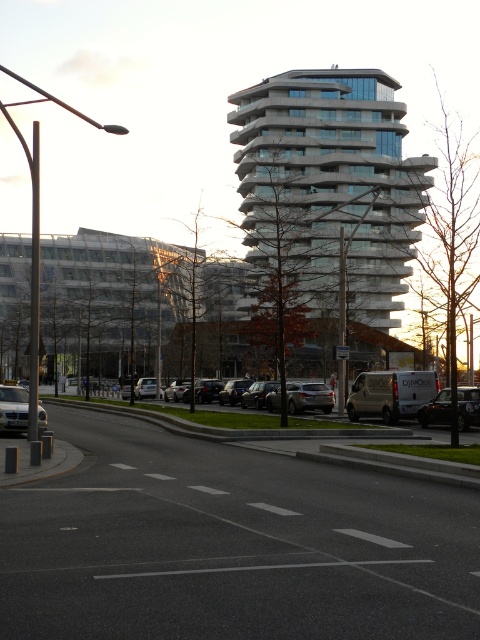
You are standing on the sidewalk on the right side of the road and want to cross to the left side. The point marked at coordinates (468, 406) shows a shiny black sedan at the right. Where exactly should you look for a safe crossing point relative to the shiny black sedan at the right?

The point marked at coordinates (468, 406) indicates the shiny black sedan at the right. To find a safe crossing point, you should look for an area away from the shiny black sedan at the right, perhaps further ahead or behind it along the road where there is no parked vehicle obstructing your path.

You are standing on the sidewalk on the right side of the road. You want to walk to the white glass building at center. Which direction should you walk along the road to reach it?

Since the white glass building at center is located at coordinates point (331, 182), you should walk along the road towards the left curve to reach it.